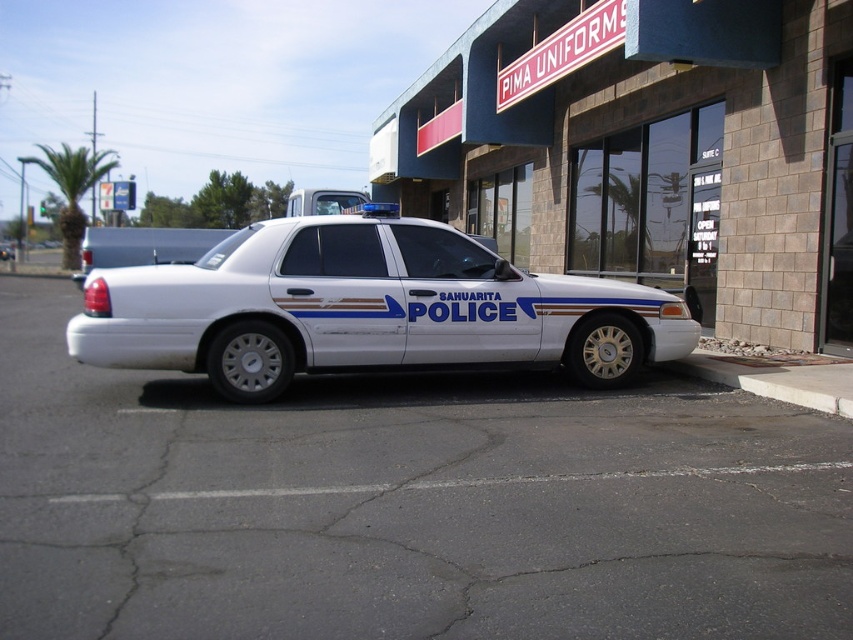
You are a photographer planning to capture the entire scene of the blue brick storefront at center and the white metallic police car at center in one shot. Considering their sizes, which object should you focus on first to ensure both are fully visible in the frame?

The blue brick storefront at center is bigger than the white metallic police car at center, so you should focus on the blue brick storefront at center first to ensure it fits entirely within the frame while also capturing the smaller police car.

You are a delivery driver who needs to park your truck next to the white metallic police car at center. The parking spot next to it can only accommodate vehicles smaller than the concrete at lower right. Can your truck fit there?

The white metallic police car at center has a smaller size compared to concrete at lower right. Since your truck needs to be smaller than the concrete at lower right to fit, and the police car is already smaller, your truck can fit in the parking spot if it is no larger than the police car.